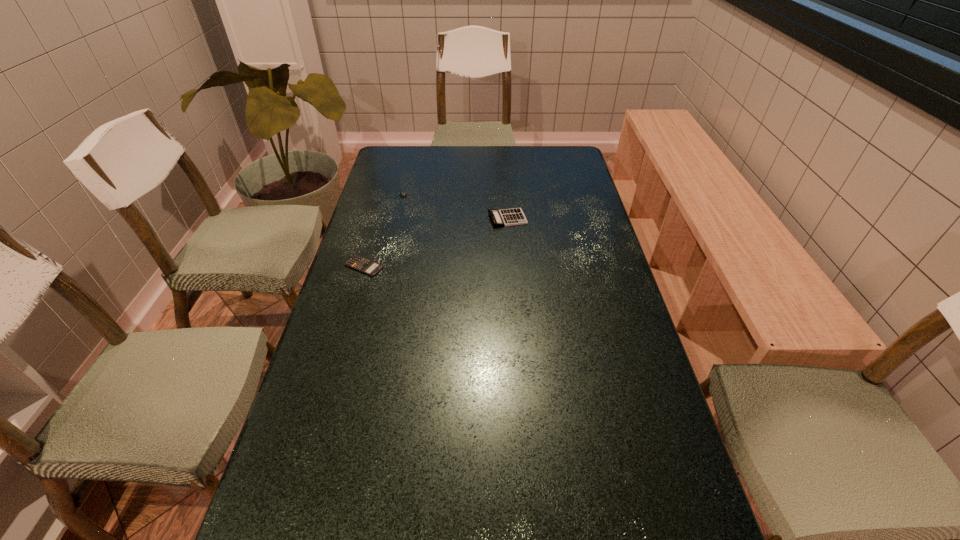
The image size is (960, 540). What are the coordinates of `calculator located at the left edge` in the screenshot? It's located at (357, 262).

Find the location of a particular element. Image resolution: width=960 pixels, height=540 pixels. vacant space at the far edge is located at coordinates (466, 152).

In the image, there is a desktop. Identify the location of vacant space at the left edge. (402, 204).

Identify the location of vacant space at the right edge of the desktop. (667, 520).

You are a GUI agent. You are given a task and a screenshot of the screen. Output one action in this format:
    pyautogui.click(x=<x>, y=<y>)
    Task: Click on the free area in between the nearest object and the second farthest object
    The height and width of the screenshot is (540, 960).
    Given the screenshot: What is the action you would take?
    pyautogui.click(x=436, y=242)

Image resolution: width=960 pixels, height=540 pixels. Identify the location of free space that is in between the taller calculator and the left calculator. (436, 242).

You are a GUI agent. You are given a task and a screenshot of the screen. Output one action in this format:
    pyautogui.click(x=<x>, y=<y>)
    Task: Click on the vacant area that lies between the nearest object and the mouse
    The image size is (960, 540).
    Given the screenshot: What is the action you would take?
    pyautogui.click(x=385, y=232)

Image resolution: width=960 pixels, height=540 pixels. I want to click on empty space that is in between the right calculator and the second tallest object, so click(456, 208).

Locate an element on the screen. Image resolution: width=960 pixels, height=540 pixels. vacant area that lies between the left calculator and the taller calculator is located at coordinates (436, 242).

Find the location of a particular element. This screenshot has height=540, width=960. empty space between the second shortest object and the farther calculator is located at coordinates (456, 208).